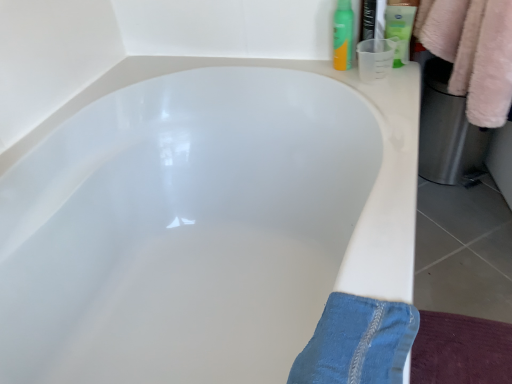
You are a GUI agent. You are given a task and a screenshot of the screen. Output one action in this format:
    pyautogui.click(x=<x>, y=<y>)
    Task: Click on the vacant space in between denim at lower right and green matte lotion at upper right, acting as the 1th toiletry starting from the right
    
    Given the screenshot: What is the action you would take?
    pos(388,173)